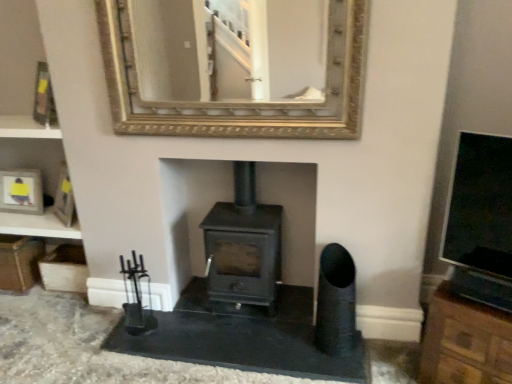
This screenshot has height=384, width=512. I want to click on blank space situated above black matte wood burning stove at center (from a real-world perspective), so click(x=243, y=218).